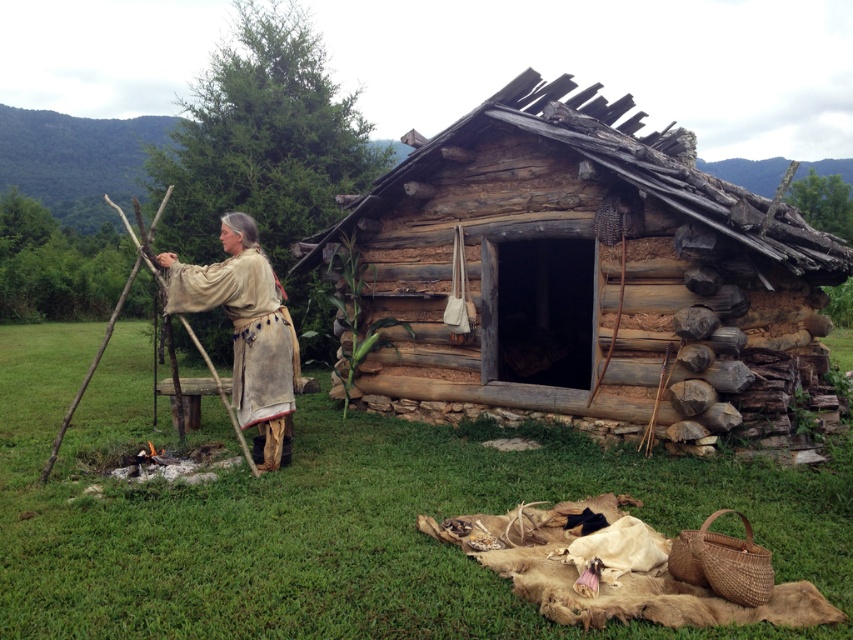
Question: Does weathered wood cabin at center appear over beige leather robe at center?

Choices:
 (A) no
 (B) yes

Answer: (B)

Question: Is weathered wood cabin at center bigger than beige leather robe at center?

Choices:
 (A) no
 (B) yes

Answer: (B)

Question: Is weathered wood cabin at center thinner than beige leather robe at center?

Choices:
 (A) yes
 (B) no

Answer: (B)

Question: Among these points, which one is farthest from the camera?

Choices:
 (A) (741, 406)
 (B) (200, 348)

Answer: (A)

Question: Which point appears closest to the camera in this image?

Choices:
 (A) (234, 240)
 (B) (656, 374)

Answer: (A)